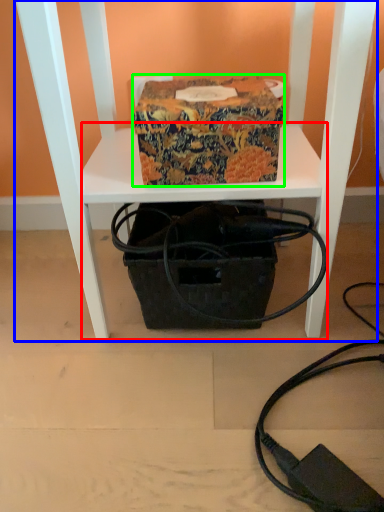
Question: Considering the real-world distances, which object is closest to table (highlighted by a red box)? furniture (highlighted by a blue box) or cardboard box (highlighted by a green box).

Choices:
 (A) furniture
 (B) cardboard box

Answer: (A)